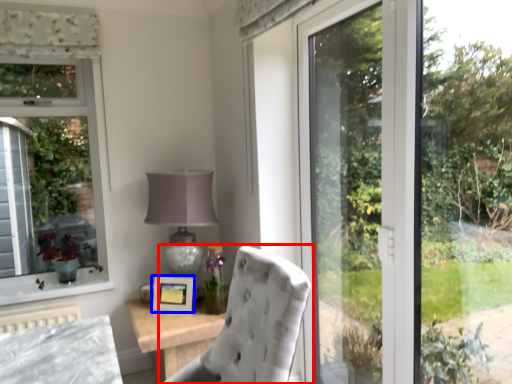
Question: Among these objects, which one is farthest to the camera, chair (highlighted by a red box) or picture frame (highlighted by a blue box)?

Choices:
 (A) chair
 (B) picture frame

Answer: (B)